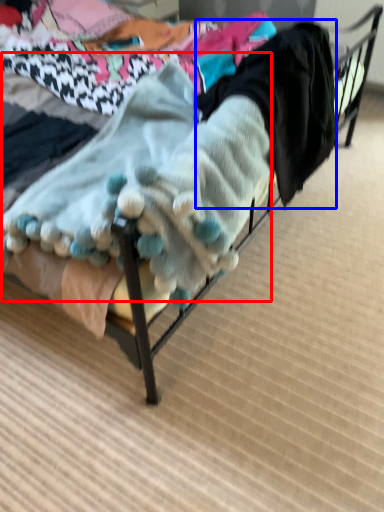
Question: Which point is further to the camera, baby clothe (highlighted by a red box) or clothing (highlighted by a blue box)?

Choices:
 (A) baby clothe
 (B) clothing

Answer: (B)